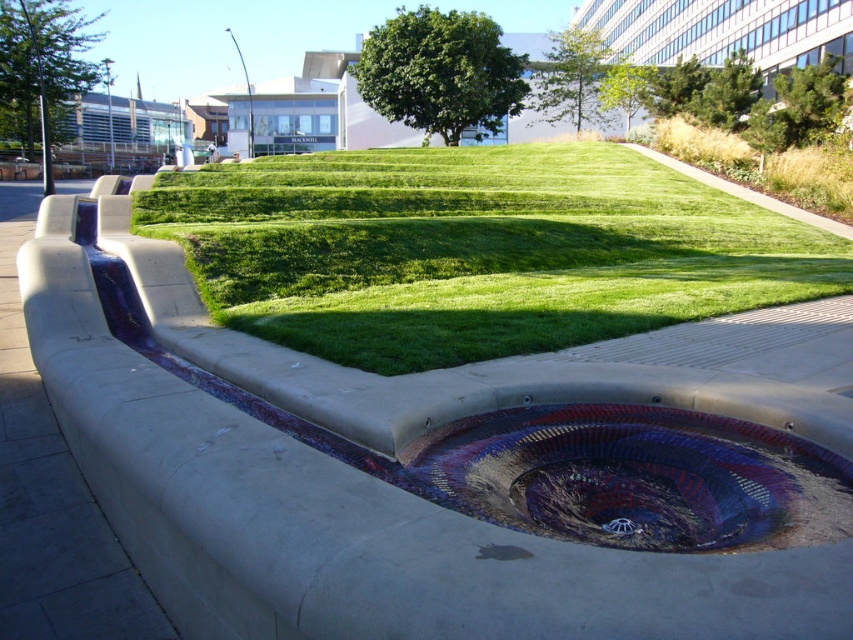
Question: Which point is farther from the camera taking this photo?

Choices:
 (A) (625, 532)
 (B) (527, 468)

Answer: (B)

Question: Does concrete at center appear on the right side of multicolored mosaic sink at center?

Choices:
 (A) no
 (B) yes

Answer: (A)

Question: Does concrete at center appear on the right side of multicolored mosaic sink at center?

Choices:
 (A) yes
 (B) no

Answer: (B)

Question: Can you confirm if concrete at center is positioned to the right of multicolored mosaic sink at center?

Choices:
 (A) no
 (B) yes

Answer: (A)